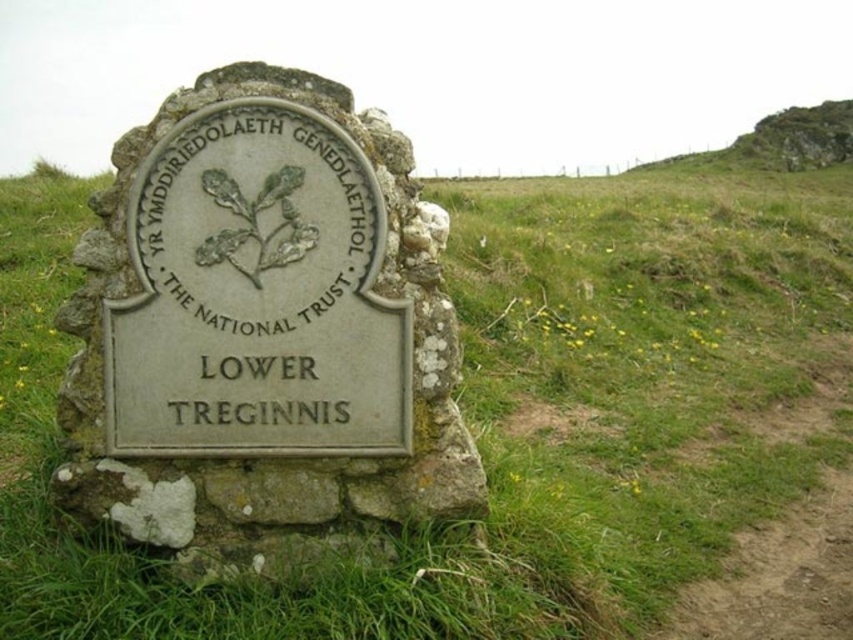
You are standing in a rural area and see a gray stone sign at center. There is a point marked at coordinates (263,333). Where exactly is this point located?

The point marked at coordinates (263,333) is located on the gray stone sign at center.